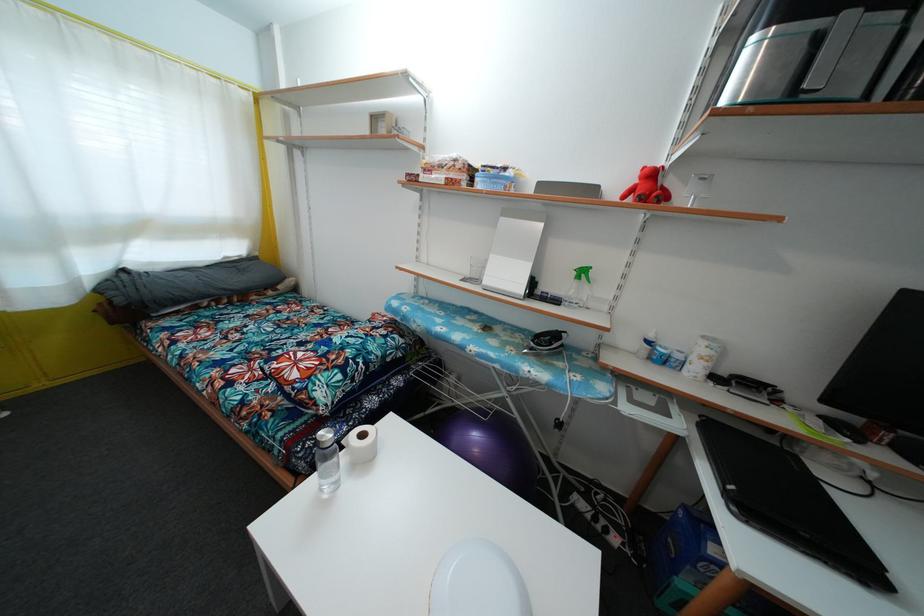
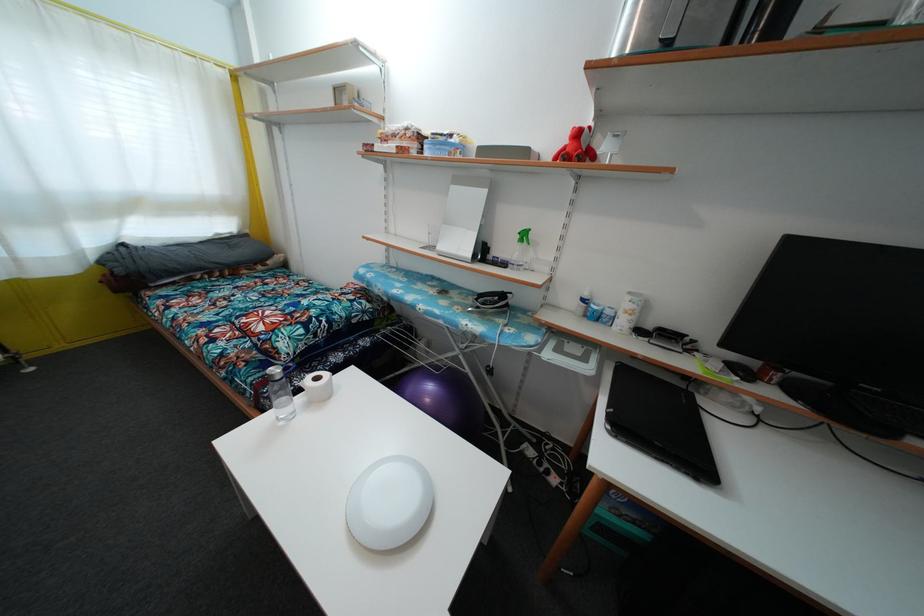
In the second image, find the point that corresponds to the point at 367,442 in the first image.

(321, 386)